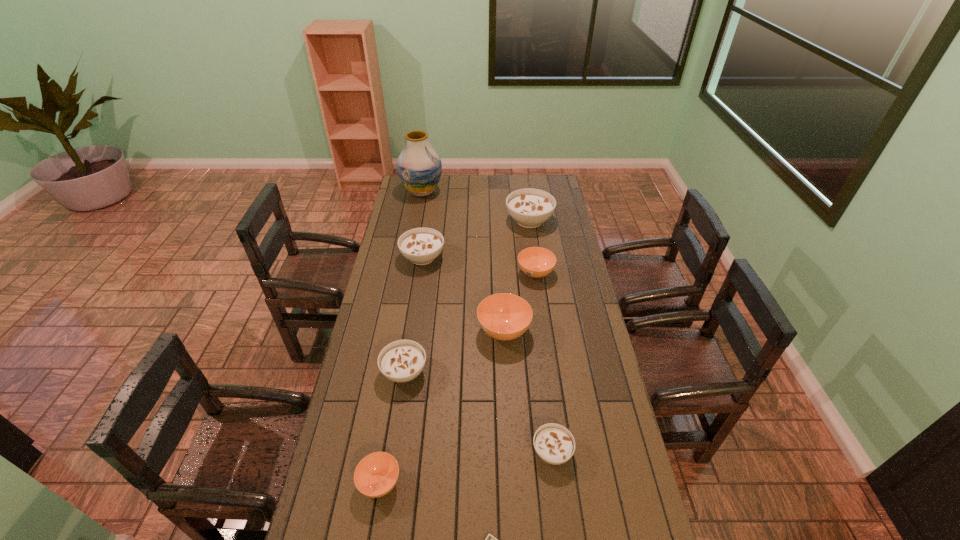
Image resolution: width=960 pixels, height=540 pixels. Identify the location of unoccupied area between the third nearest white soup bowl and the second smallest peach soup bowl. (479, 265).

Locate an element on the screen. vacant area between the third biggest white soup bowl and the nearest white soup bowl is located at coordinates (478, 411).

Locate an element on the screen. free spot between the farthest peach soup bowl and the smallest peach soup bowl is located at coordinates pos(458,378).

You are a GUI agent. You are given a task and a screenshot of the screen. Output one action in this format:
    pyautogui.click(x=<x>, y=<y>)
    Task: Click on the vacant space that's between the smallest white soup bowl and the biggest peach soup bowl
    
    Given the screenshot: What is the action you would take?
    pyautogui.click(x=528, y=391)

Locate an element on the screen. The height and width of the screenshot is (540, 960). the closest object relative to the smallest peach soup bowl is located at coordinates (490, 539).

Select which object is the fifth closest to the shortest object. Please provide its 2D coordinates. Your answer should be formatted as a tuple, i.e. [(x, y)], where the tuple contains the x and y coordinates of a point satisfying the conditions above.

[(536, 262)]

You are a GUI agent. You are given a task and a screenshot of the screen. Output one action in this format:
    pyautogui.click(x=<x>, y=<y>)
    Task: Click on the second closest soup bowl relative to the farthest soup bowl
    Image resolution: width=960 pixels, height=540 pixels.
    Given the screenshot: What is the action you would take?
    pyautogui.click(x=421, y=246)

Select which soup bowl appears as the second closest to the leftmost peach soup bowl. Please provide its 2D coordinates. Your answer should be formatted as a tuple, i.e. [(x, y)], where the tuple contains the x and y coordinates of a point satisfying the conditions above.

[(554, 444)]

Select which white soup bowl is the second closest to the tallest object. Please provide its 2D coordinates. Your answer should be formatted as a tuple, i.e. [(x, y)], where the tuple contains the x and y coordinates of a point satisfying the conditions above.

[(421, 246)]

Find the location of a particular element. the second closest white soup bowl to the biggest peach soup bowl is located at coordinates (421, 246).